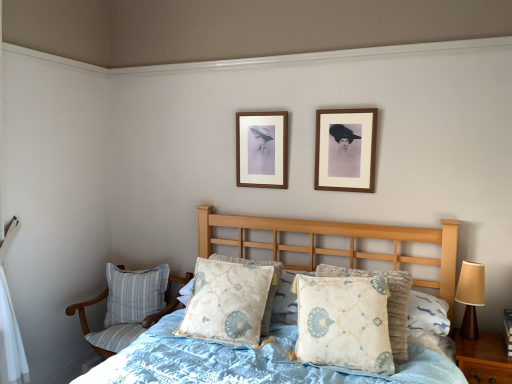
Question: Can you confirm if light blue quilted bed at center is shorter than floral-patterned fabric pillow at center, the 2th pillow viewed from the back?

Choices:
 (A) no
 (B) yes

Answer: (A)

Question: Can floral-patterned fabric pillow at center, the 2th pillow from the front, be found inside light blue quilted bed at center?

Choices:
 (A) no
 (B) yes

Answer: (B)

Question: Is light blue quilted bed at center further to camera compared to floral-patterned fabric pillow at center, the second pillow from the right?

Choices:
 (A) no
 (B) yes

Answer: (A)

Question: From the image's perspective, would you say light blue quilted bed at center is shown under floral-patterned fabric pillow at center, the 2th pillow from the front?

Choices:
 (A) no
 (B) yes

Answer: (B)

Question: From a real-world perspective, is light blue quilted bed at center on top of floral-patterned fabric pillow at center, the 2th pillow positioned from the left?

Choices:
 (A) no
 (B) yes

Answer: (A)

Question: Is light blue quilted bed at center thinner than floral-patterned fabric pillow at center, the 2th pillow viewed from the back?

Choices:
 (A) no
 (B) yes

Answer: (A)

Question: Are light blue quilted bed at center and wooden picture frame at upper center, the 2th picture frame in the right-to-left sequence, beside each other?

Choices:
 (A) yes
 (B) no

Answer: (B)

Question: Can you confirm if light blue quilted bed at center is bigger than wooden picture frame at upper center, the second picture frame when ordered from front to back?

Choices:
 (A) yes
 (B) no

Answer: (A)

Question: Is light blue quilted bed at center to the left of wooden picture frame at upper center, the 1th picture frame viewed from the left, from the viewer's perspective?

Choices:
 (A) yes
 (B) no

Answer: (A)

Question: From the image's perspective, is light blue quilted bed at center located above wooden picture frame at upper center, the 2th picture frame in the right-to-left sequence?

Choices:
 (A) no
 (B) yes

Answer: (A)

Question: Can we say light blue quilted bed at center lies outside wooden picture frame at upper center, the 1th picture frame viewed from the left?

Choices:
 (A) yes
 (B) no

Answer: (A)

Question: Is light blue quilted bed at center in front of wooden picture frame at upper center, the 1th picture frame viewed from the left?

Choices:
 (A) no
 (B) yes

Answer: (B)

Question: Is floral-patterned fabric pillow at center, the second pillow from the right, not near wooden picture frame at upper center, acting as the second picture frame starting from the left?

Choices:
 (A) yes
 (B) no

Answer: (B)